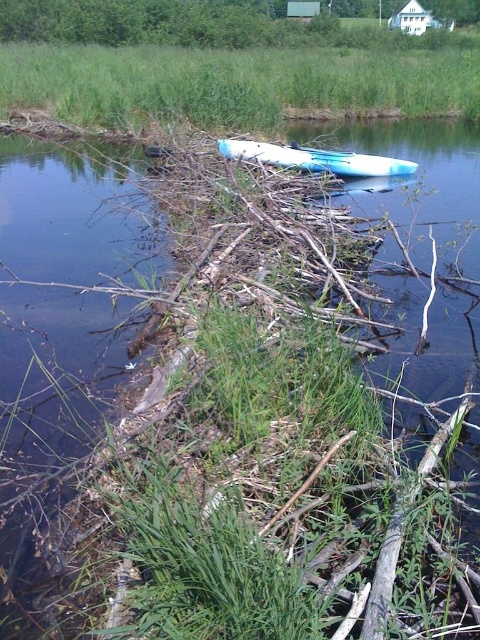
You are standing at the point marked as point (231,83) in the image. What type of terrain are you currently standing on?

The point (231,83) is on green grass at center.